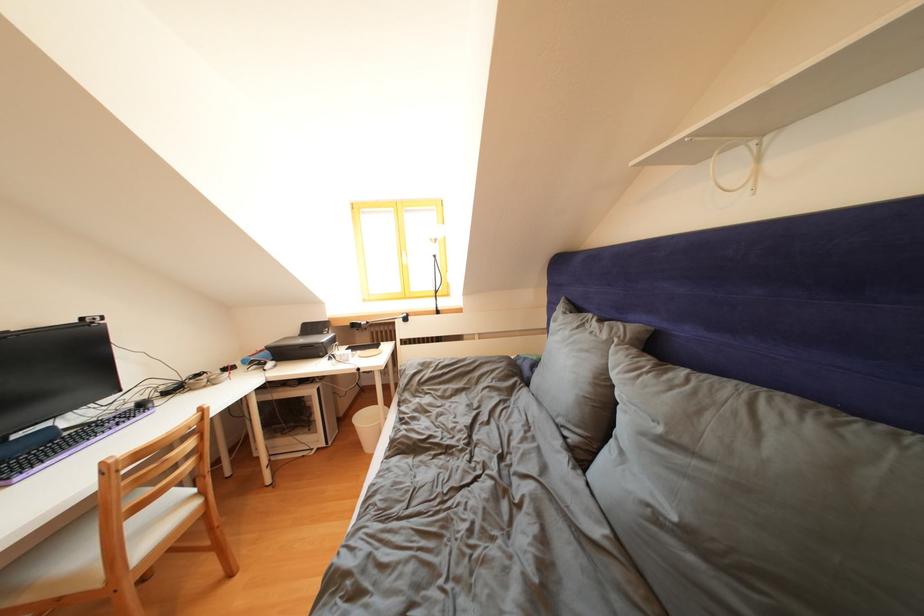
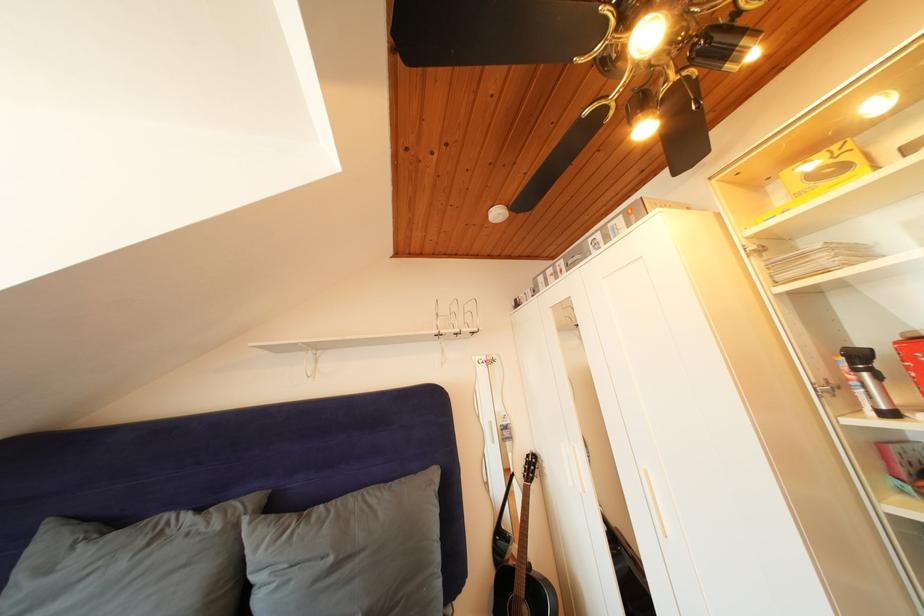
The point at (612, 341) is marked in the first image. Where is the corresponding point in the second image?

(225, 531)